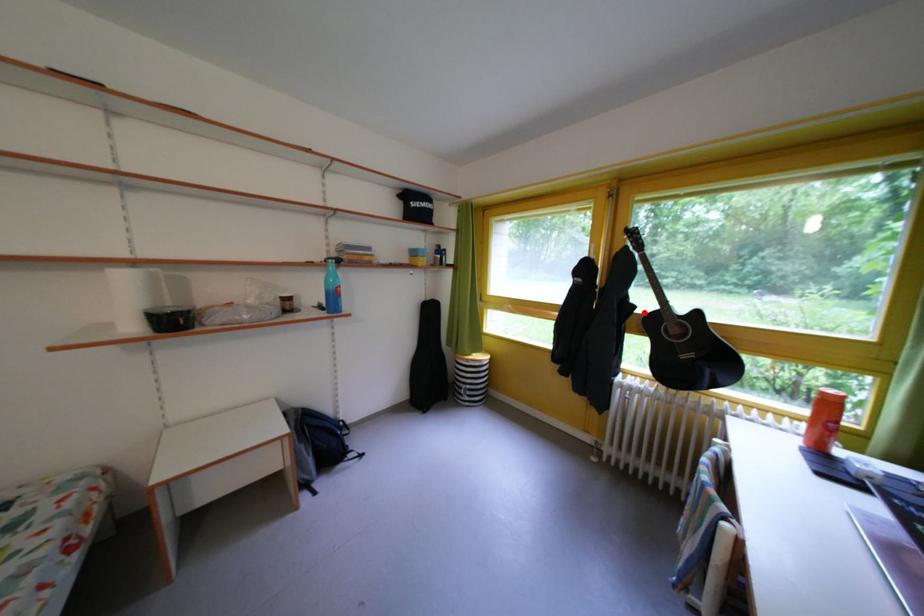
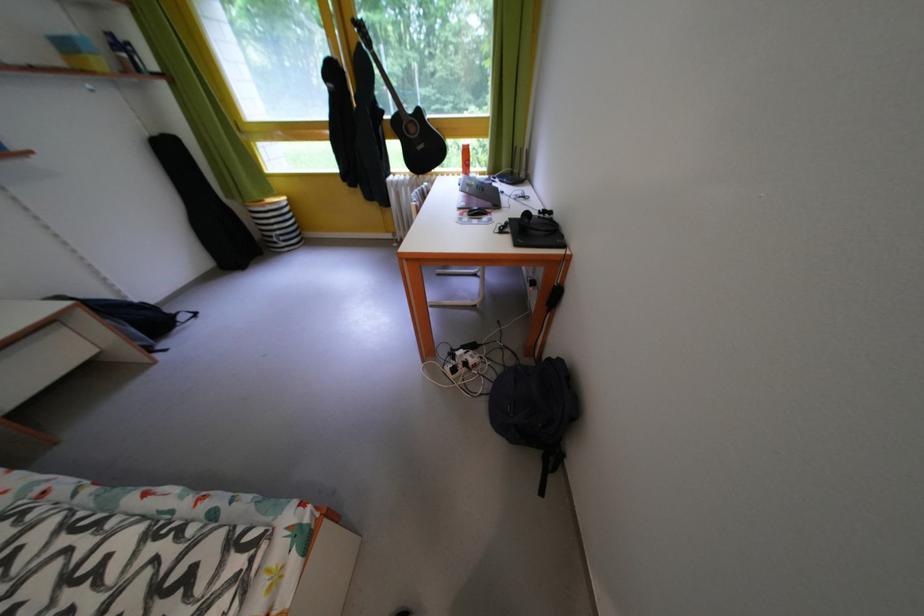
Question: A red point is marked in image1. In image2, is the corresponding 3D point closer to the camera or farther? Reply with the corresponding letter.

Choices:
 (A) The corresponding 3D point is closer.
 (B) The corresponding 3D point is farther.

Answer: (A)